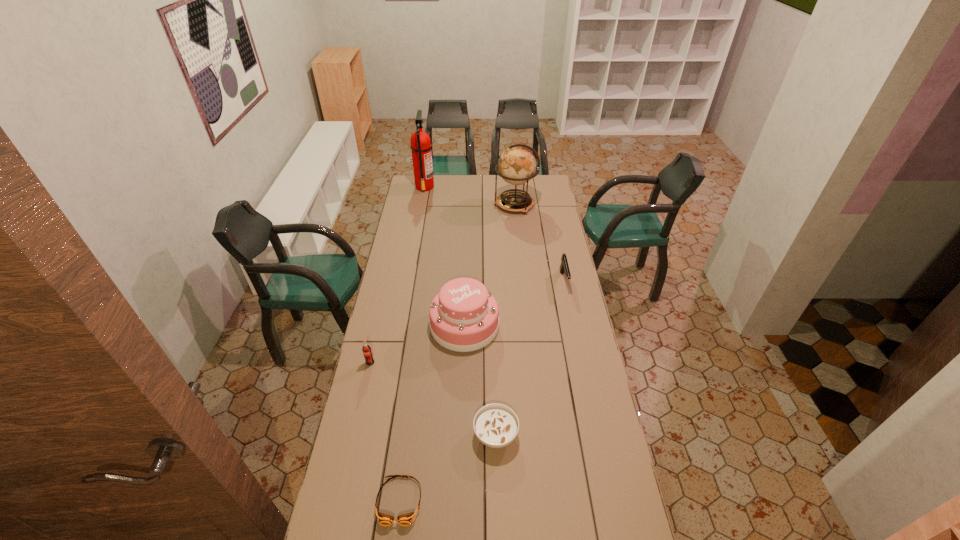
You are a GUI agent. You are given a task and a screenshot of the screen. Output one action in this format:
    pyautogui.click(x=<x>, y=<y>)
    Task: Click on the goggles
    Image resolution: width=960 pixels, height=540 pixels.
    Given the screenshot: What is the action you would take?
    pyautogui.click(x=384, y=519)

This screenshot has height=540, width=960. Find the location of `the nearest object`. the nearest object is located at coordinates (384, 519).

Find the location of a particular element. The image size is (960, 540). blank area located on the side of the fire extinguisher near the handle is located at coordinates (449, 187).

You are a GUI agent. You are given a task and a screenshot of the screen. Output one action in this format:
    pyautogui.click(x=<x>, y=<y>)
    Task: Click on the free location located 0.050m at the center of the globe
    
    Given the screenshot: What is the action you would take?
    pyautogui.click(x=484, y=205)

Locate an element on the screen. Image resolution: width=960 pixels, height=540 pixels. vacant space located 0.330m at the center of the globe is located at coordinates (438, 205).

The width and height of the screenshot is (960, 540). What are the coordinates of `blank area located at the center of the globe` in the screenshot? It's located at (469, 205).

The image size is (960, 540). Identify the location of vacant space situated on the front of the fifth shortest object. (463, 364).

Identify the location of vacant space located on the label of the fourth shortest object. This screenshot has height=540, width=960. (352, 442).

This screenshot has width=960, height=540. I want to click on free space located 0.280m at the muzzle of the third farthest object, so click(576, 340).

Find the location of a particular element. The width and height of the screenshot is (960, 540). vacant region located 0.230m on the right of the second shortest object is located at coordinates (584, 435).